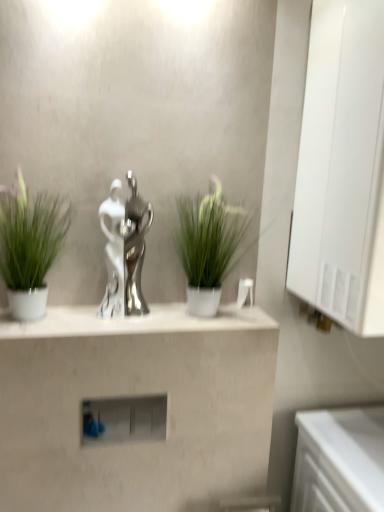
Question: From a real-world perspective, is silver metallic trophy at center beneath matte white shelf at center?

Choices:
 (A) no
 (B) yes

Answer: (A)

Question: Is the position of silver metallic trophy at center more distant than that of matte white shelf at center?

Choices:
 (A) yes
 (B) no

Answer: (B)

Question: Is silver metallic trophy at center far away from matte white shelf at center?

Choices:
 (A) yes
 (B) no

Answer: (A)

Question: Does silver metallic trophy at center appear on the left side of matte white shelf at center?

Choices:
 (A) no
 (B) yes

Answer: (B)

Question: Considering the relative sizes of silver metallic trophy at center and matte white shelf at center in the image provided, is silver metallic trophy at center wider than matte white shelf at center?

Choices:
 (A) no
 (B) yes

Answer: (B)

Question: From the image's perspective, is silver metallic trophy at center under matte white shelf at center?

Choices:
 (A) yes
 (B) no

Answer: (B)

Question: From a real-world perspective, is satin silver statue at center physically above white glossy counter at lower right?

Choices:
 (A) yes
 (B) no

Answer: (A)

Question: Is satin silver statue at center at the left side of white glossy counter at lower right?

Choices:
 (A) yes
 (B) no

Answer: (A)

Question: Does satin silver statue at center have a greater height compared to white glossy counter at lower right?

Choices:
 (A) no
 (B) yes

Answer: (A)

Question: Does satin silver statue at center have a lesser width compared to white glossy counter at lower right?

Choices:
 (A) yes
 (B) no

Answer: (A)

Question: Is satin silver statue at center completely or partially outside of white glossy counter at lower right?

Choices:
 (A) yes
 (B) no

Answer: (A)

Question: Can you confirm if satin silver statue at center is positioned to the right of white glossy counter at lower right?

Choices:
 (A) no
 (B) yes

Answer: (A)

Question: From the image's perspective, is white glossy counter at lower right on top of silver metallic trophy at center?

Choices:
 (A) no
 (B) yes

Answer: (A)